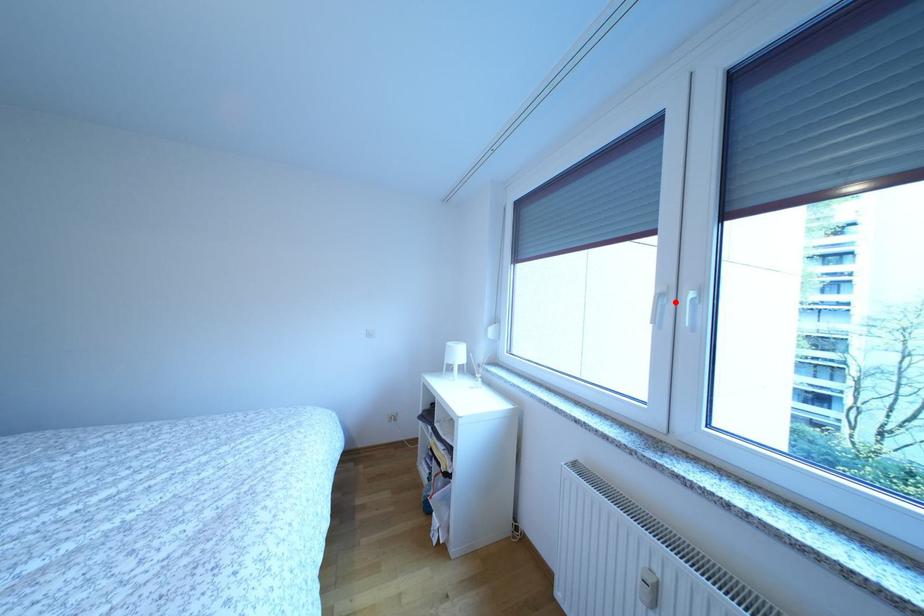
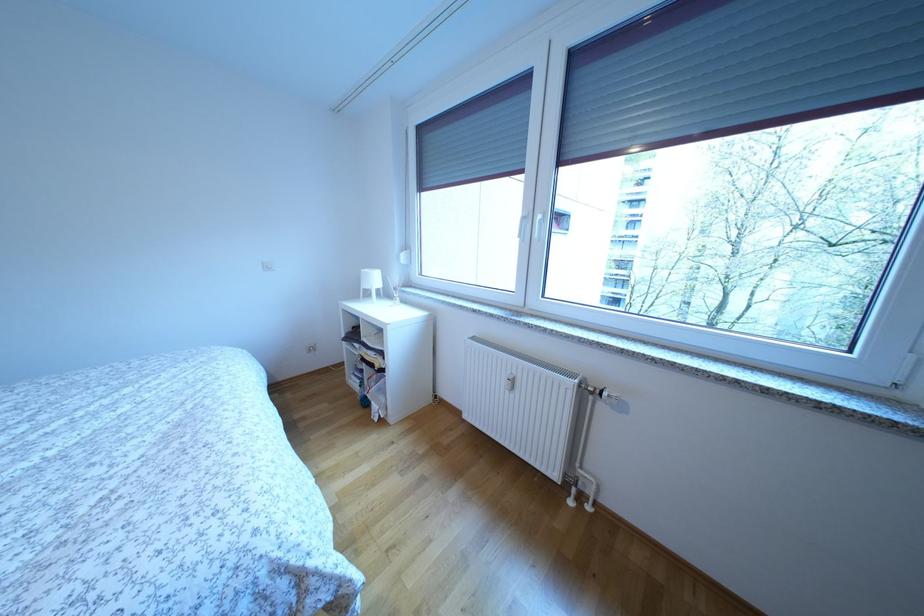
The point at the highlighted location is marked in the first image. Where is the corresponding point in the second image?

(535, 224)